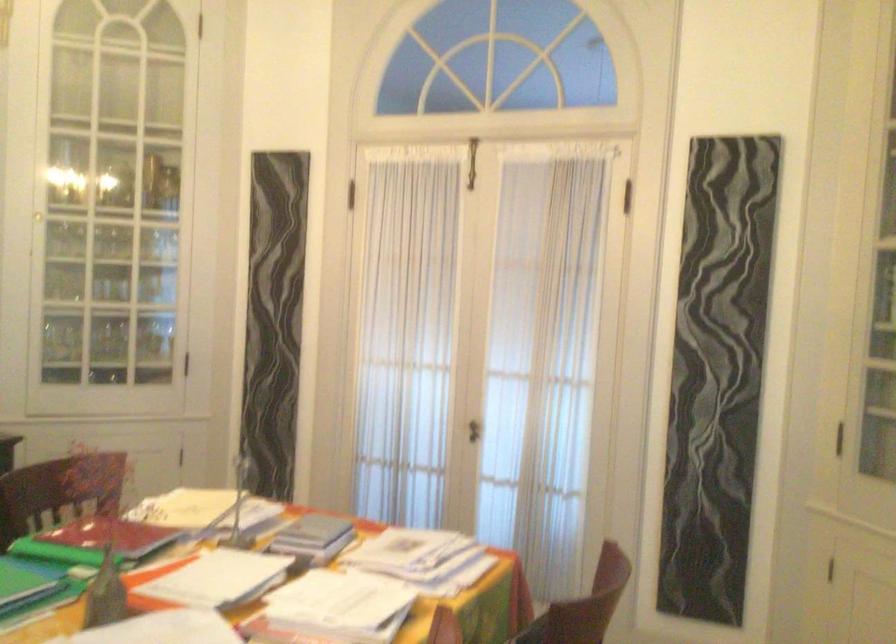
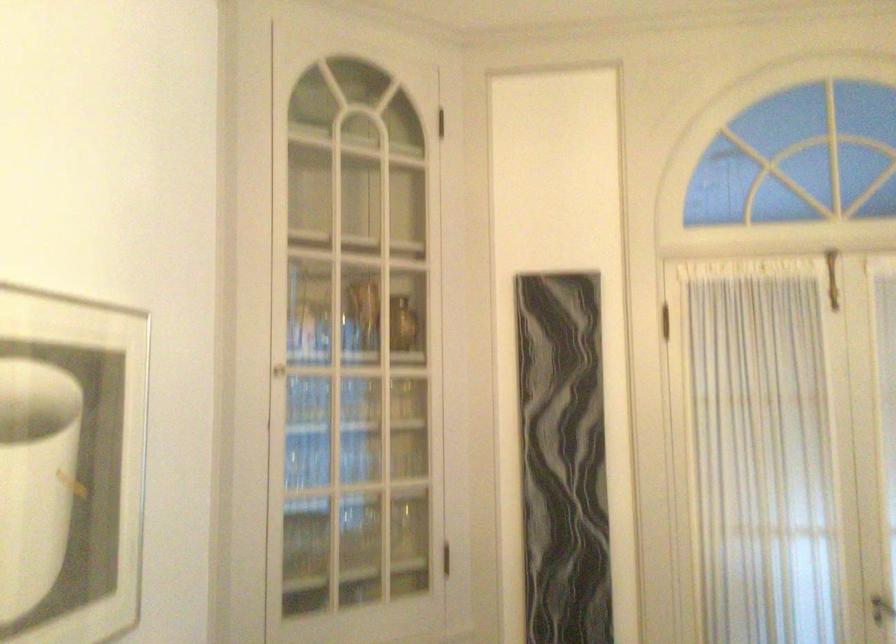
The point at (474, 418) is marked in the first image. Where is the corresponding point in the second image?

(882, 609)